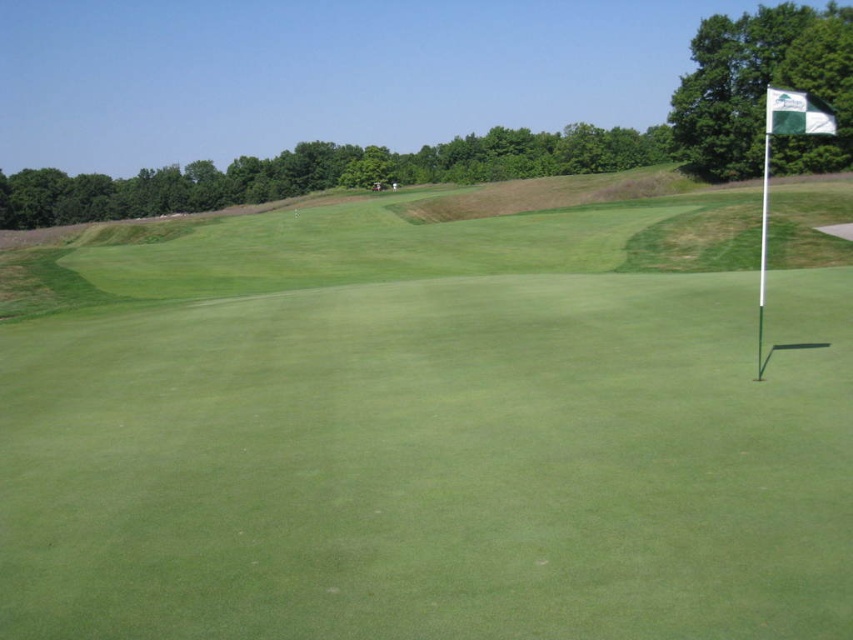
Question: Does green grassy golf course at center appear on the left side of green fabric flag at right?

Choices:
 (A) yes
 (B) no

Answer: (A)

Question: Is green grassy golf course at center below green fabric flag at right?

Choices:
 (A) yes
 (B) no

Answer: (A)

Question: Does green grassy golf course at center have a smaller size compared to green fabric flag at right?

Choices:
 (A) yes
 (B) no

Answer: (B)

Question: Among these objects, which one is farthest from the camera?

Choices:
 (A) green fabric flag at right
 (B) green grassy golf course at center

Answer: (A)

Question: Which point is farther to the camera?

Choices:
 (A) (790, 129)
 (B) (577, 406)

Answer: (A)